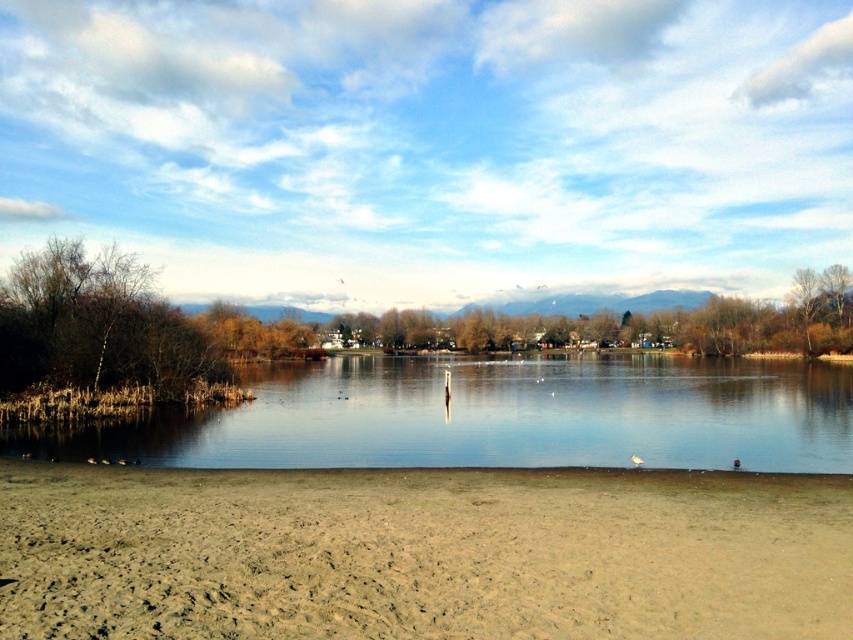
You are standing on the brown sandy beach at lower center and want to reach the clear water at center. Which direction should you move to get there?

To reach the clear water at center from the brown sandy beach at lower center, you should move to the right side since the brown sandy beach at lower center is positioned on the left side of clear water at center.

From the picture: You are standing at the center of the image and want to walk to the brown sandy beach at lower center. Which direction should you move in to reach it?

The brown sandy beach at lower center is located at point (421, 554), so you should move downward and slightly to the right to reach it.

Looking at this image, you are standing on the brown sandy beach at lower center and want to reach the clear water at center. Which direction should you move to get there?

Since the brown sandy beach at lower center is in front of the clear water at center, you should move forward towards the clear water at center to reach it.